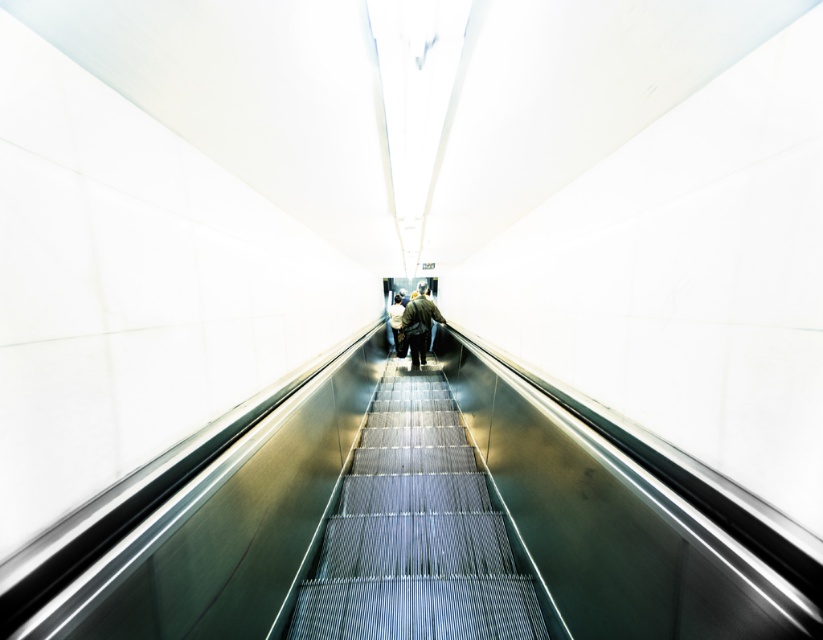
You are standing at the bottom of the escalator and see the metallic silver stairs at center and the green textured jacket at center. Which object is positioned to the right side from your viewpoint?

The metallic silver stairs at center is to the right of the green textured jacket at center, so the metallic silver stairs at center is positioned to the right side from your viewpoint.

In the scene shown: You are at the bottom of an escalator and see the metallic silver stairs at center and the green textured jacket at center. Which object is closer to you?

The metallic silver stairs at center are closer to you than the green textured jacket at center.

You are standing at the bottom of the escalator and want to step onto the metallic silver stairs at center. Based on their position, which direction should you walk to reach them?

The metallic silver stairs at center are located at point [415,532], so you should walk straight ahead towards the center of the escalator to reach them.